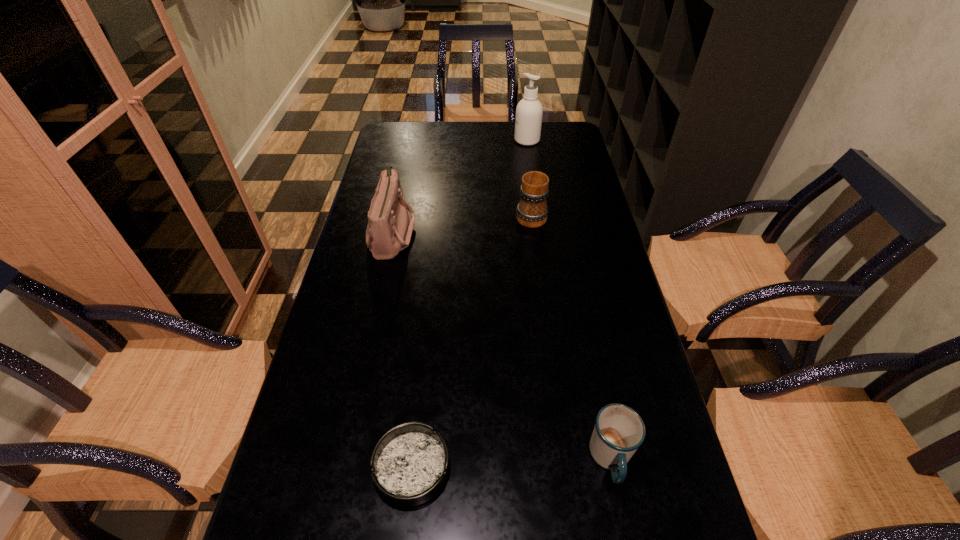
Locate an element on the screen. The width and height of the screenshot is (960, 540). the farthest object is located at coordinates (529, 111).

At what (x,y) coordinates should I click in order to perform the action: click on the tallest object. Please return your answer as a coordinate pair (x, y). Looking at the image, I should click on (529, 111).

I want to click on shoulder bag, so click(x=389, y=230).

The image size is (960, 540). I want to click on the taller mug, so click(532, 211).

Where is `the farther mug`? the farther mug is located at coordinates click(532, 211).

Image resolution: width=960 pixels, height=540 pixels. What are the coordinates of `the shorter mug` in the screenshot? It's located at (619, 431).

At what (x,y) coordinates should I click in order to perform the action: click on the right mug. Please return your answer as a coordinate pair (x, y). The image size is (960, 540). Looking at the image, I should click on (619, 431).

Where is `the shortest object`? The height and width of the screenshot is (540, 960). the shortest object is located at coordinates (410, 464).

The width and height of the screenshot is (960, 540). I want to click on blank space located 0.380m on the front label of the tallest object, so click(415, 140).

The height and width of the screenshot is (540, 960). What are the coordinates of `blank space located on the front label of the tallest object` in the screenshot? It's located at (488, 140).